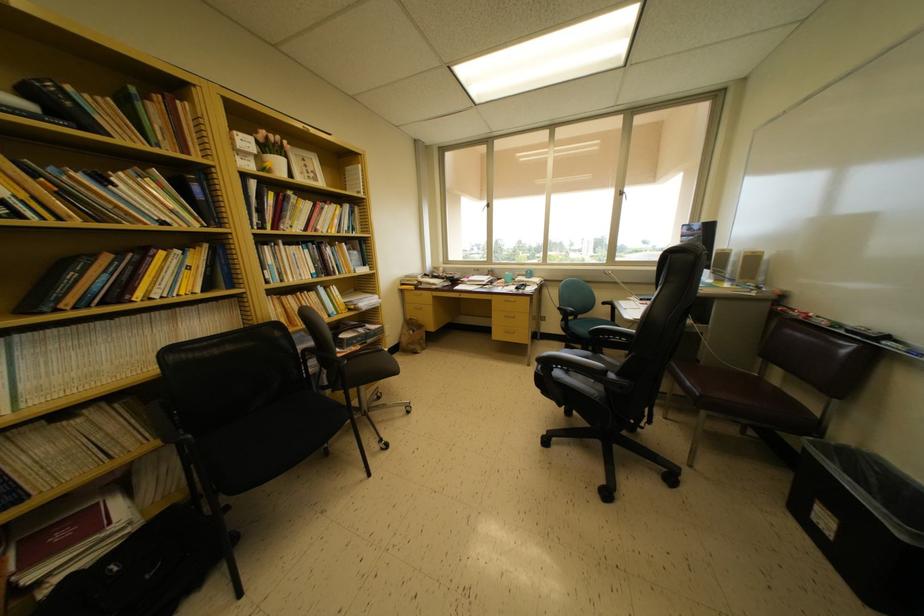
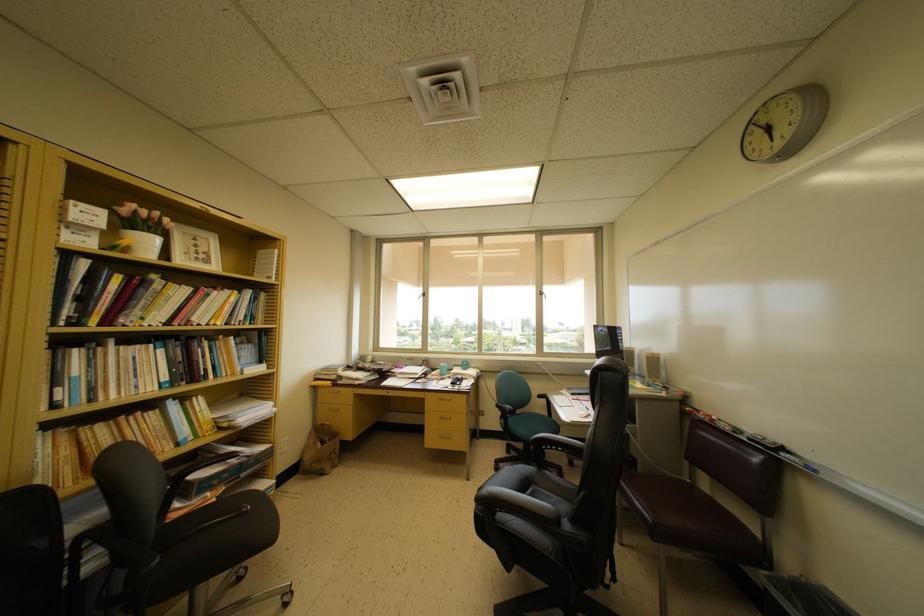
Where in the second image is the point corresponding to (892,342) from the first image?

(786, 454)